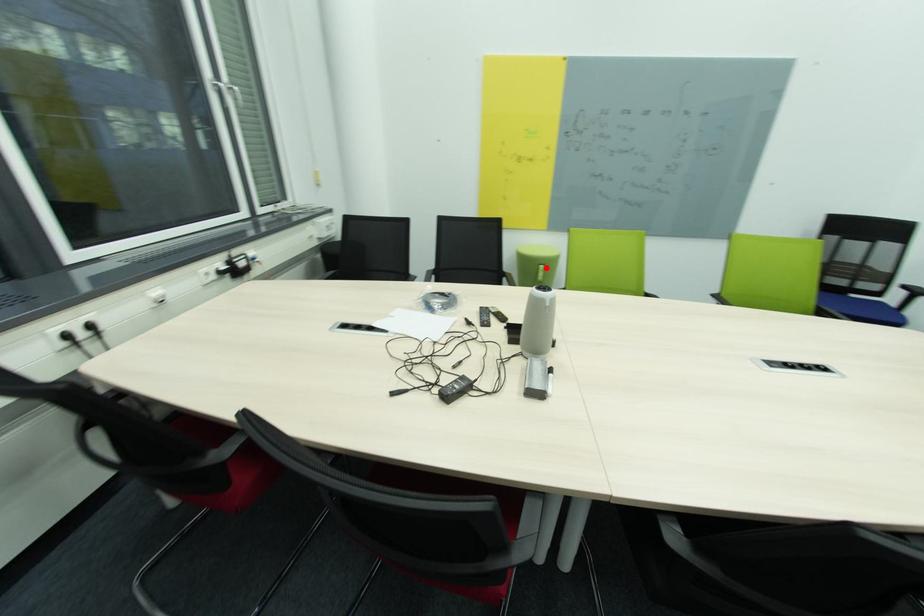
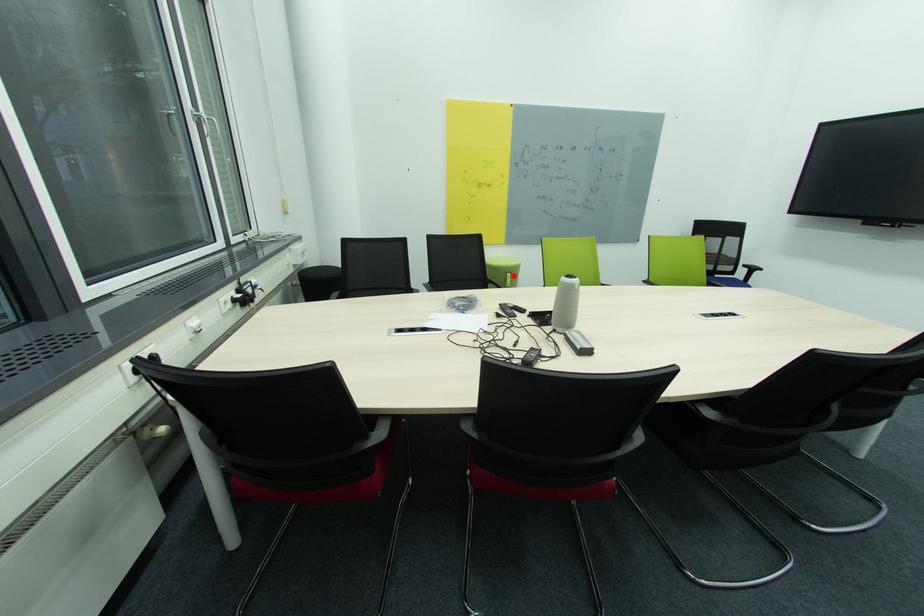
I am providing you with two images of the same scene from different viewpoints. A red point is marked on the first image and another point is marked on the second image. Does the point marked in image1 correspond to the same location as the one in image2?

Yes